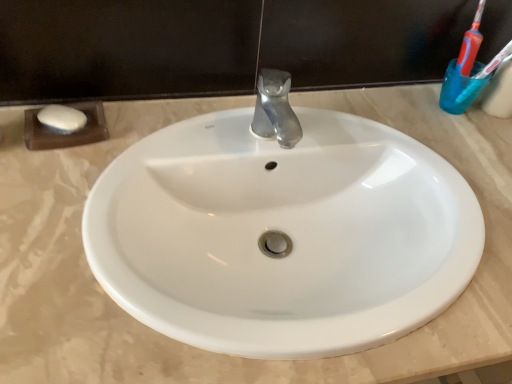
This screenshot has width=512, height=384. Describe the element at coordinates (282, 234) in the screenshot. I see `white glossy sink at center` at that location.

This screenshot has height=384, width=512. What do you see at coordinates (459, 89) in the screenshot?
I see `transparent plastic cup at upper right` at bounding box center [459, 89].

Locate an element on the screen. The height and width of the screenshot is (384, 512). translucent plastic toothbrush at upper right is located at coordinates (495, 62).

Does translucent plastic toothbrush at upper right lie behind transparent plastic cup at upper right?

No, translucent plastic toothbrush at upper right is closer to the viewer.

Is translucent plastic toothbrush at upper right oriented towards transparent plastic cup at upper right?

No, translucent plastic toothbrush at upper right is not aimed at transparent plastic cup at upper right.

Is translucent plastic toothbrush at upper right not inside transparent plastic cup at upper right?

Answer: Yes, translucent plastic toothbrush at upper right is outside of transparent plastic cup at upper right.

Which object is wider, translucent plastic toothbrush at upper right or transparent plastic cup at upper right?

With larger width is transparent plastic cup at upper right.

Measure the distance from white glossy sink at center to translucent plastic toothbrush at upper right.

white glossy sink at center is 17.64 inches from translucent plastic toothbrush at upper right.

Does point (266, 222) lie behind point (509, 43)?

No, it is not.

From a real-world perspective, which is physically above, white glossy sink at center or translucent plastic toothbrush at upper right?

From a 3D spatial view, translucent plastic toothbrush at upper right is above.

Is transparent plastic cup at upper right positioned before white glossy sink at center?

That is False.

From the image's perspective, is transparent plastic cup at upper right over white glossy sink at center?

Indeed, from the image's perspective, transparent plastic cup at upper right is shown above white glossy sink at center.

Is transparent plastic cup at upper right oriented towards white glossy sink at center?

No, transparent plastic cup at upper right is not facing towards white glossy sink at center.

Which is more to the right, transparent plastic cup at upper right or white glossy sink at center?

transparent plastic cup at upper right.

Is point (467, 88) farther from viewer compared to point (272, 183)?

Yes, point (467, 88) is farther from viewer.

Could you tell me if translucent plastic toothbrush at upper right is turned towards white glossy sink at center?

No, translucent plastic toothbrush at upper right does not turn towards white glossy sink at center.

Considering the sizes of translucent plastic toothbrush at upper right and white glossy sink at center in the image, is translucent plastic toothbrush at upper right taller or shorter than white glossy sink at center?

In the image, translucent plastic toothbrush at upper right appears to be taller than white glossy sink at center.

Which is correct: translucent plastic toothbrush at upper right is inside white glossy sink at center, or outside of it?

translucent plastic toothbrush at upper right is outside white glossy sink at center.

From a real-world perspective, is white glossy sink at center on top of transparent plastic cup at upper right?

Actually, white glossy sink at center is physically below transparent plastic cup at upper right in the real world.

The image size is (512, 384). Find the location of `liquid on the right of white glossy sink at center`. liquid on the right of white glossy sink at center is located at coordinates (459, 89).

From the image's perspective, which is below, white glossy sink at center or transparent plastic cup at upper right?

white glossy sink at center appears lower in the image.

Considering the points (399, 250) and (440, 94), which point is in front, point (399, 250) or point (440, 94)?

Positioned in front is point (399, 250).

At what (x,y) coordinates should I click in order to perform the action: click on toothbrush above the transparent plastic cup at upper right (from a real-world perspective). Please return your answer as a coordinate pair (x, y). Image resolution: width=512 pixels, height=384 pixels. Looking at the image, I should click on (495, 62).

How different are the orientations of transparent plastic cup at upper right and translucent plastic toothbrush at upper right in degrees?

The angular difference between transparent plastic cup at upper right and translucent plastic toothbrush at upper right is 0.798 degrees.

Between transparent plastic cup at upper right and translucent plastic toothbrush at upper right, which one has smaller width?

With smaller width is translucent plastic toothbrush at upper right.

Does transparent plastic cup at upper right appear on the right side of translucent plastic toothbrush at upper right?

Incorrect, transparent plastic cup at upper right is not on the right side of translucent plastic toothbrush at upper right.

The width and height of the screenshot is (512, 384). What are the coordinates of `liquid behind the translucent plastic toothbrush at upper right` in the screenshot? It's located at (459, 89).

Locate an element on the screen. sink lying in front of the translucent plastic toothbrush at upper right is located at coordinates (282, 234).

Based on their spatial positions, is transparent plastic cup at upper right or translucent plastic toothbrush at upper right further from white glossy sink at center?

translucent plastic toothbrush at upper right is further to white glossy sink at center.

Considering their positions, is transparent plastic cup at upper right positioned closer to translucent plastic toothbrush at upper right than white glossy sink at center?

transparent plastic cup at upper right is closer to translucent plastic toothbrush at upper right.

Looking at the image, which one is located further to transparent plastic cup at upper right, translucent plastic toothbrush at upper right or white glossy sink at center?

white glossy sink at center is positioned further to the anchor transparent plastic cup at upper right.

Based on their spatial positions, is white glossy sink at center or translucent plastic toothbrush at upper right closer to transparent plastic cup at upper right?

translucent plastic toothbrush at upper right lies closer to transparent plastic cup at upper right than the other object.

When comparing their distances from translucent plastic toothbrush at upper right, does white glossy sink at center or transparent plastic cup at upper right seem closer?

transparent plastic cup at upper right.

Estimate the real-world distances between objects in this image. Which object is further from white glossy sink at center, translucent plastic toothbrush at upper right or transparent plastic cup at upper right?

The object further to white glossy sink at center is translucent plastic toothbrush at upper right.

Image resolution: width=512 pixels, height=384 pixels. I want to click on toothbrush between white glossy sink at center and transparent plastic cup at upper right in the front-back direction, so click(x=495, y=62).